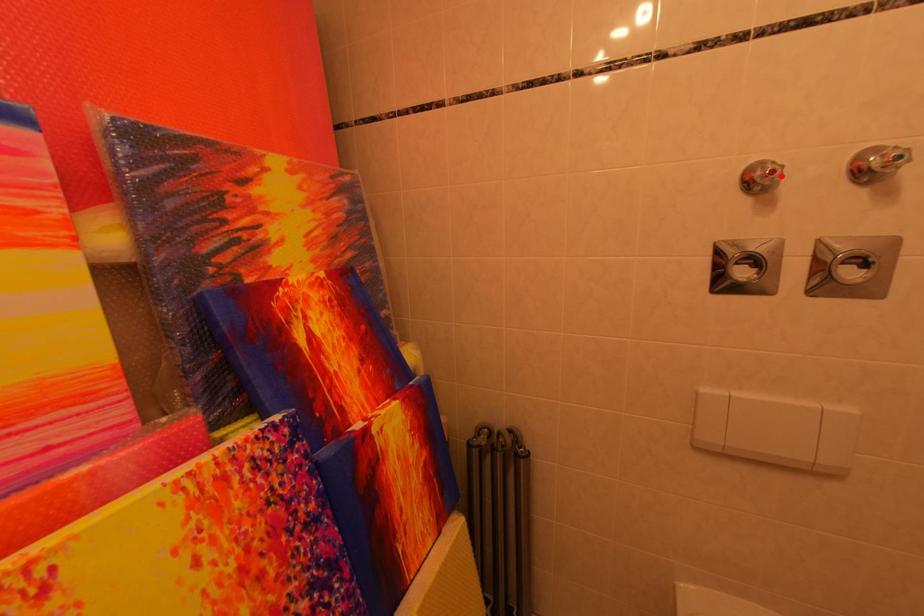
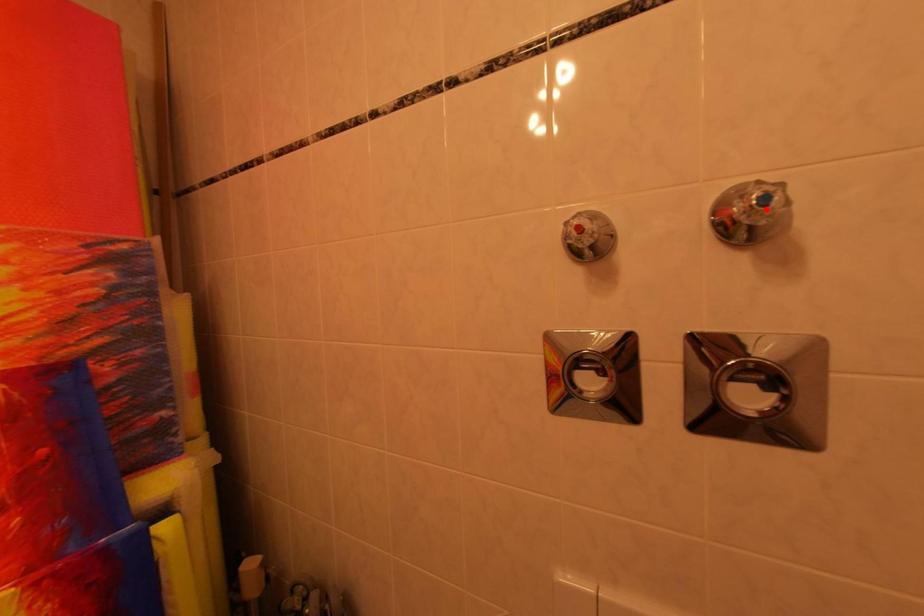
I am providing you with two images of the same scene from different viewpoints. A red point is marked on the first image and another point is marked on the second image. Does the point marked in image1 correspond to the same location as the one in image2?

No